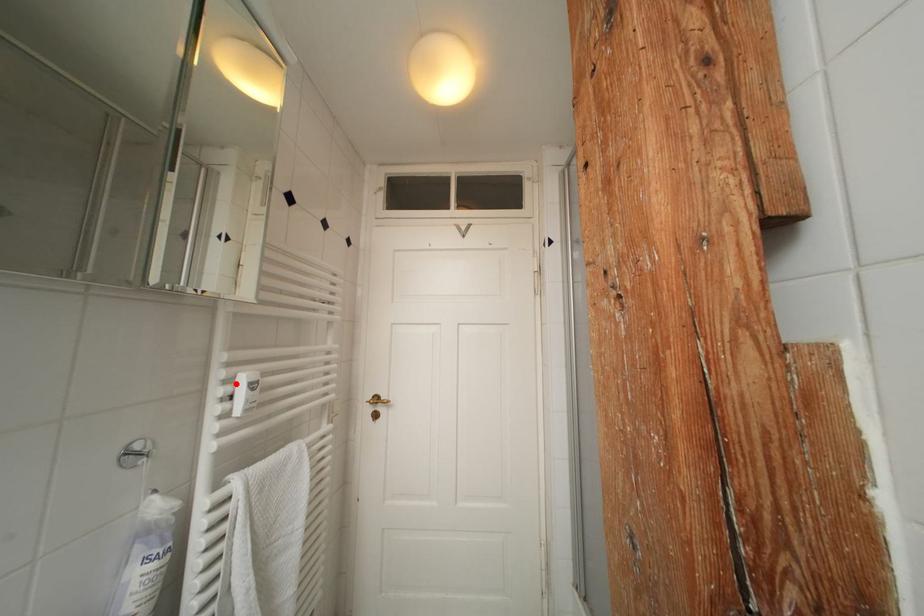
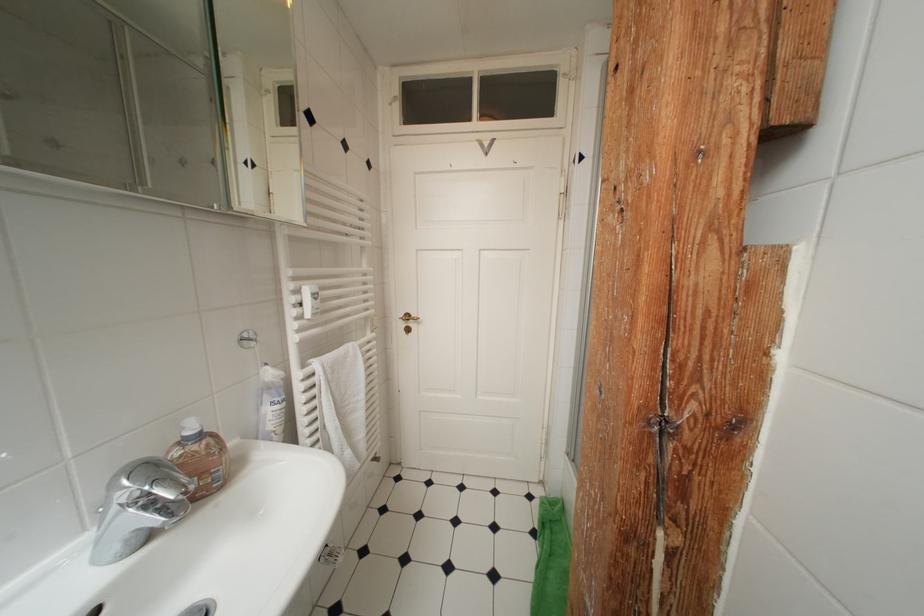
In the second image, find the point that corresponds to the highlighted location in the first image.

(304, 294)